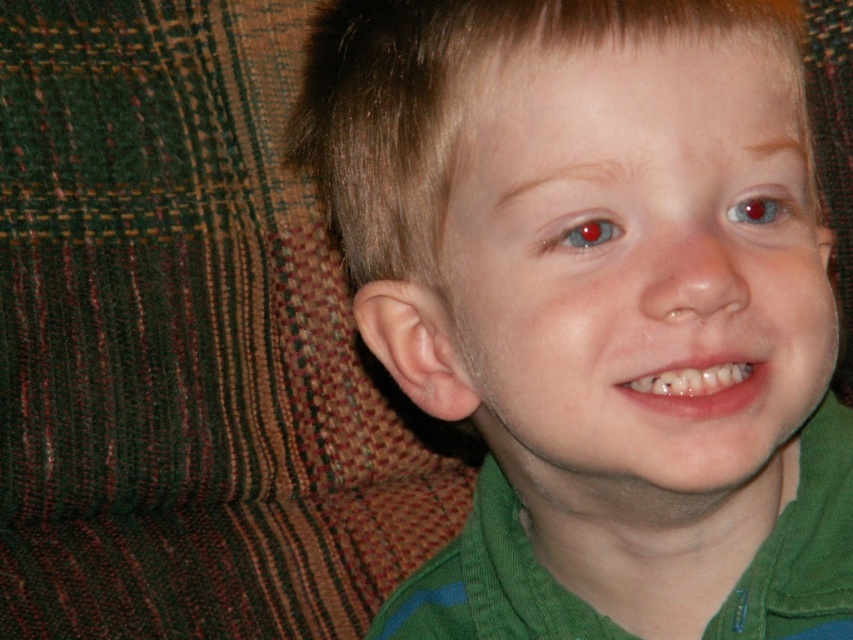
Looking at this image, is glossy blue eye at upper center bigger than red glossy eye at upper center?

Correct, glossy blue eye at upper center is larger in size than red glossy eye at upper center.

The width and height of the screenshot is (853, 640). What do you see at coordinates (585, 234) in the screenshot?
I see `glossy blue eye at upper center` at bounding box center [585, 234].

Identify the location of glossy blue eye at upper center. pyautogui.click(x=585, y=234).

Which is more to the right, green corduroy shirt at center or glossy blue eye at upper center?

Positioned to the right is glossy blue eye at upper center.

Is green corduroy shirt at center wider than glossy blue eye at upper center?

Yes.

Who is more forward, (361, 228) or (607, 228)?

Positioned in front is point (607, 228).

Image resolution: width=853 pixels, height=640 pixels. In order to click on green corduroy shirt at center in this screenshot , I will do point(592,304).

In the scene shown: Is green corduroy shirt at center taller than red glossy eye at upper center?

Yes.

Does green corduroy shirt at center appear on the left side of red glossy eye at upper center?

Correct, you'll find green corduroy shirt at center to the left of red glossy eye at upper center.

This screenshot has width=853, height=640. What do you see at coordinates (592, 304) in the screenshot? I see `green corduroy shirt at center` at bounding box center [592, 304].

The width and height of the screenshot is (853, 640). What are the coordinates of `green corduroy shirt at center` in the screenshot? It's located at (592, 304).